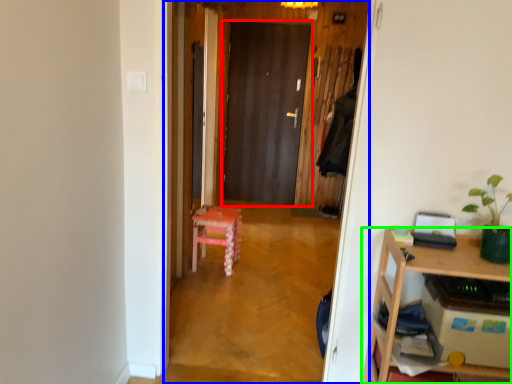
Question: Estimate the real-world distances between objects in this image. Which object is closer to door (highlighted by a red box), corridor (highlighted by a blue box) or desk (highlighted by a green box)?

Choices:
 (A) corridor
 (B) desk

Answer: (A)